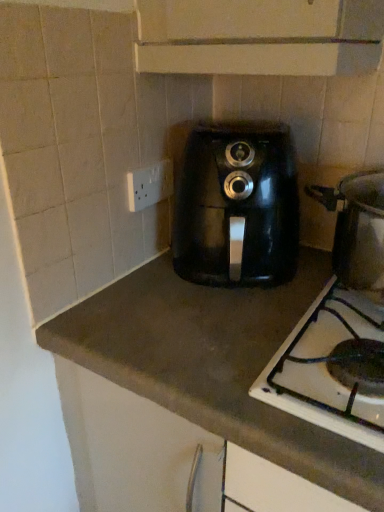
Question: Can you confirm if black matte gas stove at lower right is wider than brown matte countertop at center?

Choices:
 (A) yes
 (B) no

Answer: (A)

Question: Considering the relative positions of black matte gas stove at lower right and brown matte countertop at center in the image provided, is black matte gas stove at lower right to the left of brown matte countertop at center from the viewer's perspective?

Choices:
 (A) yes
 (B) no

Answer: (B)

Question: Is black matte gas stove at lower right far from brown matte countertop at center?

Choices:
 (A) yes
 (B) no

Answer: (B)

Question: Does black matte gas stove at lower right come behind brown matte countertop at center?

Choices:
 (A) yes
 (B) no

Answer: (B)

Question: Is black matte gas stove at lower right outside brown matte countertop at center?

Choices:
 (A) yes
 (B) no

Answer: (A)

Question: In terms of size, does white plastic socket at upper left appear bigger or smaller than brown matte countertop at center?

Choices:
 (A) big
 (B) small

Answer: (B)

Question: Would you say white plastic socket at upper left is inside or outside brown matte countertop at center?

Choices:
 (A) outside
 (B) inside

Answer: (A)

Question: From a real-world perspective, is white plastic socket at upper left above or below brown matte countertop at center?

Choices:
 (A) below
 (B) above

Answer: (B)

Question: From the image's perspective, is white plastic socket at upper left positioned above or below brown matte countertop at center?

Choices:
 (A) above
 (B) below

Answer: (A)

Question: Is point (137, 353) positioned closer to the camera than point (339, 434)?

Choices:
 (A) closer
 (B) farther

Answer: (B)

Question: Is brown matte countertop at center in front of or behind black matte gas stove at lower right in the image?

Choices:
 (A) behind
 (B) front

Answer: (A)

Question: From the image's perspective, is brown matte countertop at center above or below black matte gas stove at lower right?

Choices:
 (A) below
 (B) above

Answer: (B)

Question: In the image, is brown matte countertop at center on the left side or the right side of black matte gas stove at lower right?

Choices:
 (A) right
 (B) left

Answer: (B)

Question: Visually, is brown matte countertop at center positioned to the left or to the right of black plastic air fryer at center?

Choices:
 (A) left
 (B) right

Answer: (A)

Question: From a real-world perspective, is brown matte countertop at center above or below black plastic air fryer at center?

Choices:
 (A) below
 (B) above

Answer: (A)